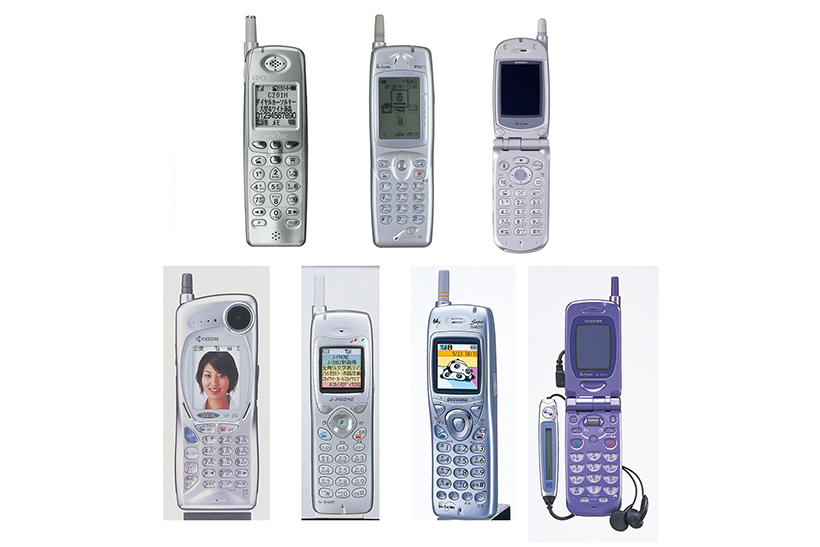
Identify the location of screen. (213, 389).